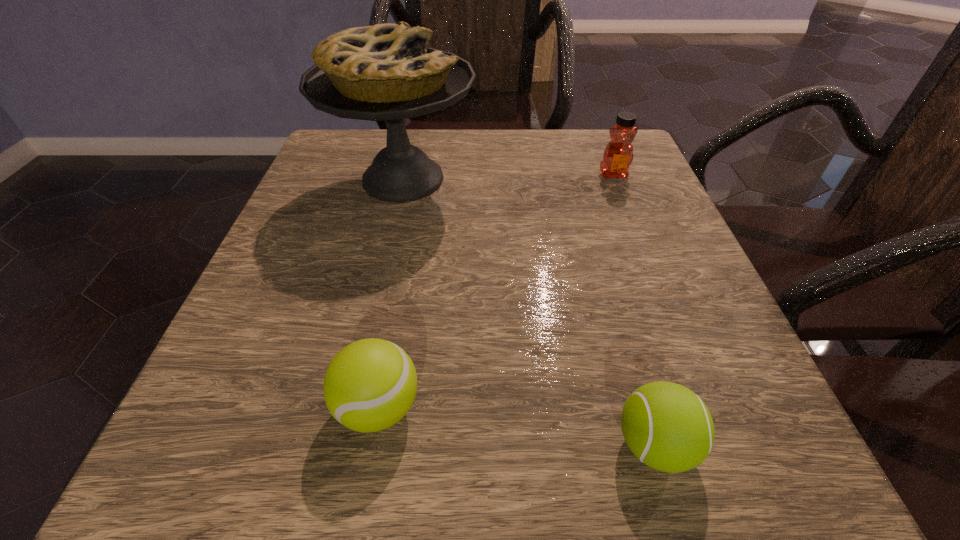
This screenshot has width=960, height=540. I want to click on free point between the pie and the honey, so click(508, 177).

Identify the location of the second closest object to the honey. (668, 427).

Locate which object is the third closest to the left tennis ball. Please provide its 2D coordinates. Your answer should be formatted as a tuple, i.e. [(x, y)], where the tuple contains the x and y coordinates of a point satisfying the conditions above.

[(618, 155)]

Locate an element on the screen. The image size is (960, 540). blank space that satisfies the following two spatial constraints: 1. on the front label of the honey; 2. on the cut side of the pie is located at coordinates (615, 179).

The image size is (960, 540). Identify the location of free space that satisfies the following two spatial constraints: 1. on the front label of the honey; 2. on the cut side of the tallest object. (615, 179).

Identify the location of blank area in the image that satisfies the following two spatial constraints: 1. on the cut side of the right tennis ball; 2. on the left side of the tallest object. (344, 445).

Where is `free space that satisfies the following two spatial constraints: 1. on the cut side of the right tennis ball; 2. on the left side of the tallest object`? Image resolution: width=960 pixels, height=540 pixels. free space that satisfies the following two spatial constraints: 1. on the cut side of the right tennis ball; 2. on the left side of the tallest object is located at coordinates (344, 445).

Image resolution: width=960 pixels, height=540 pixels. What are the coordinates of `vacant space that satisfies the following two spatial constraints: 1. on the cut side of the pie; 2. on the right side of the right tennis ball` in the screenshot? It's located at (344, 445).

Where is `vacant space that satisfies the following two spatial constraints: 1. on the cut side of the tallest object; 2. on the back side of the left tennis ball`? vacant space that satisfies the following two spatial constraints: 1. on the cut side of the tallest object; 2. on the back side of the left tennis ball is located at coordinates (352, 407).

You are a GUI agent. You are given a task and a screenshot of the screen. Output one action in this format:
    pyautogui.click(x=<x>, y=<y>)
    Task: Click on the vacant position in the image that satisfies the following two spatial constraints: 1. on the cut side of the pie; 2. on the back side of the right tennis ball
    This screenshot has width=960, height=540.
    Given the screenshot: What is the action you would take?
    pyautogui.click(x=344, y=445)